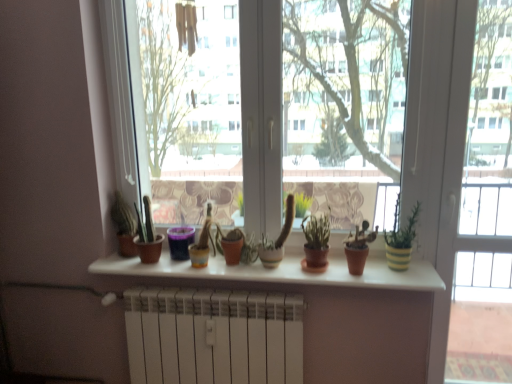
Question: Is yellow striped pot at right, the 1th houseplant positioned from the right, closer to the viewer compared to matte white shelf at center?

Choices:
 (A) yes
 (B) no

Answer: (B)

Question: Is yellow striped pot at right, the 1th houseplant positioned from the right, facing away from matte white shelf at center?

Choices:
 (A) no
 (B) yes

Answer: (A)

Question: Considering the relative sizes of yellow striped pot at right, the 1th houseplant positioned from the right, and matte white shelf at center in the image provided, is yellow striped pot at right, the 1th houseplant positioned from the right, wider than matte white shelf at center?

Choices:
 (A) yes
 (B) no

Answer: (B)

Question: Can you confirm if yellow striped pot at right, the 1th houseplant positioned from the right, is positioned to the left of matte white shelf at center?

Choices:
 (A) no
 (B) yes

Answer: (A)

Question: From a real-world perspective, is yellow striped pot at right, which is the second houseplant from left to right, located beneath matte white shelf at center?

Choices:
 (A) no
 (B) yes

Answer: (A)

Question: Can you confirm if transparent glass screen door at right is smaller than white matte radiator at lower center?

Choices:
 (A) yes
 (B) no

Answer: (A)

Question: Does transparent glass screen door at right turn towards white matte radiator at lower center?

Choices:
 (A) no
 (B) yes

Answer: (A)

Question: Can you confirm if transparent glass screen door at right is bigger than white matte radiator at lower center?

Choices:
 (A) no
 (B) yes

Answer: (A)

Question: Does transparent glass screen door at right appear on the right side of white matte radiator at lower center?

Choices:
 (A) no
 (B) yes

Answer: (B)

Question: Is transparent glass screen door at right with white matte radiator at lower center?

Choices:
 (A) no
 (B) yes

Answer: (A)

Question: Is transparent glass screen door at right looking in the opposite direction of white matte radiator at lower center?

Choices:
 (A) no
 (B) yes

Answer: (A)

Question: Does green matte plant at center, which is the second houseplant from right to left, contain purple plastic cup at center, the first flowerpot when ordered from left to right?

Choices:
 (A) yes
 (B) no

Answer: (B)